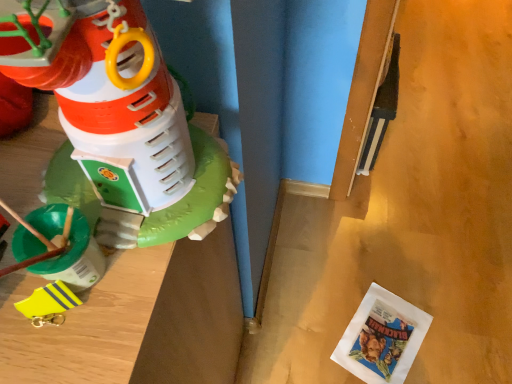
Question: Is yellow rubber boot at left, marked as the 1th toy in a bottom-to-top arrangement, in front of or behind matte plastic toy at left, the 2th toy viewed from the back, in the image?

Choices:
 (A) front
 (B) behind

Answer: (B)

Question: Choose the correct answer: Is yellow rubber boot at left, marked as the 1th toy in a bottom-to-top arrangement, inside matte plastic toy at left, placed as the 2th toy when sorted from bottom to top, or outside it?

Choices:
 (A) outside
 (B) inside

Answer: (A)

Question: Which object is positioned closest to the matte plastic toy at left, the 2th toy viewed from the back?

Choices:
 (A) yellow rubber boot at left, which appears as the 1th toy when viewed from the back
 (B) white paper comic book at lower right

Answer: (A)

Question: Which is nearer to the white paper comic book at lower right?

Choices:
 (A) matte plastic toy at left, which appears as the first toy when viewed from the front
 (B) yellow rubber boot at left, the 2th toy when ordered from front to back

Answer: (A)